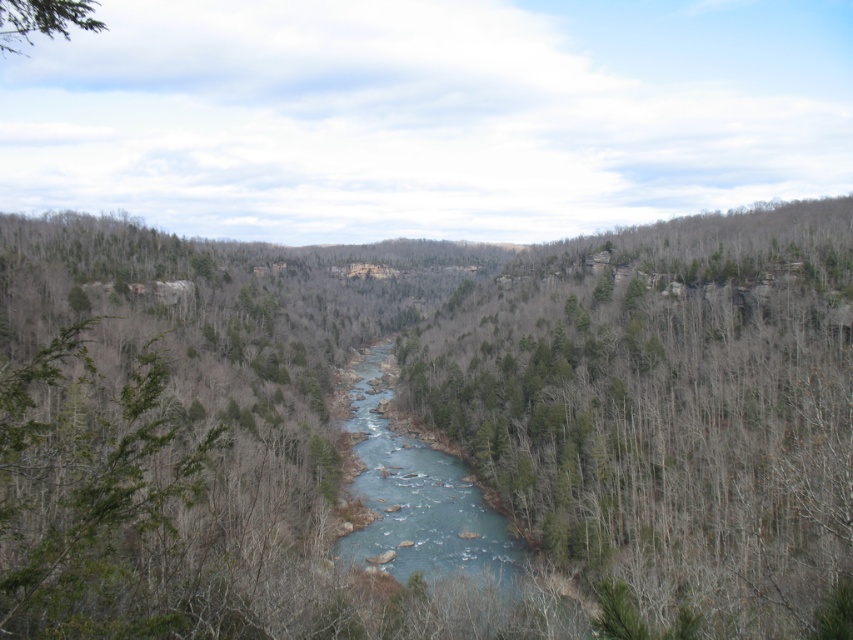
Question: Can you confirm if green leafy forest at center is smaller than blue smooth water at center?

Choices:
 (A) no
 (B) yes

Answer: (A)

Question: Based on their relative distances, which object is nearer to the green leafy forest at center?

Choices:
 (A) blue smooth water at center
 (B) green leafy tree at upper left

Answer: (A)

Question: Estimate the real-world distances between objects in this image. Which object is farther from the green leafy tree at upper left?

Choices:
 (A) green leafy forest at center
 (B) blue smooth water at center

Answer: (B)

Question: Does blue smooth water at center appear under green leafy tree at upper left?

Choices:
 (A) yes
 (B) no

Answer: (A)

Question: Which of the following is the farthest from the observer?

Choices:
 (A) blue smooth water at center
 (B) green leafy forest at center
 (C) green leafy tree at upper left

Answer: (A)

Question: Considering the relative positions of green leafy forest at center and green leafy tree at upper left in the image provided, where is green leafy forest at center located with respect to green leafy tree at upper left?

Choices:
 (A) below
 (B) above

Answer: (A)